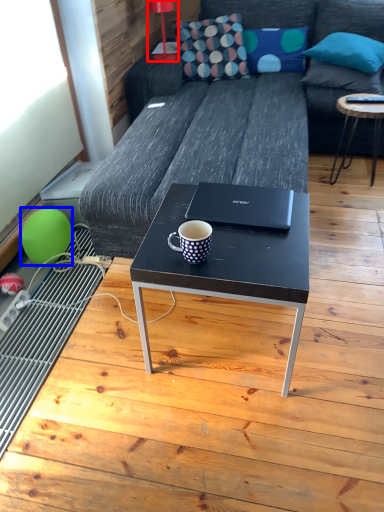
Question: Which object is further to the camera taking this photo, lamp (highlighted by a red box) or balloon (highlighted by a blue box)?

Choices:
 (A) lamp
 (B) balloon

Answer: (A)